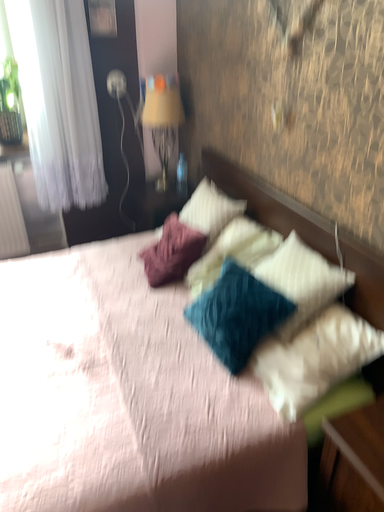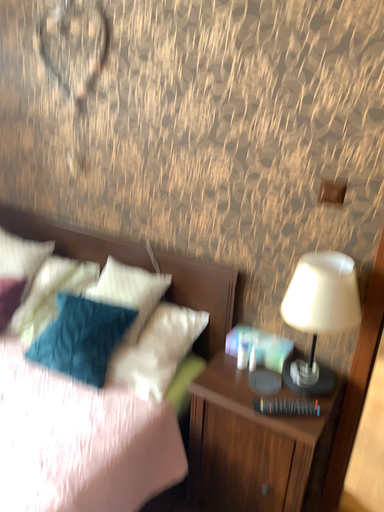
Question: How did the camera likely rotate when shooting the video?

Choices:
 (A) rotated left
 (B) rotated right

Answer: (B)